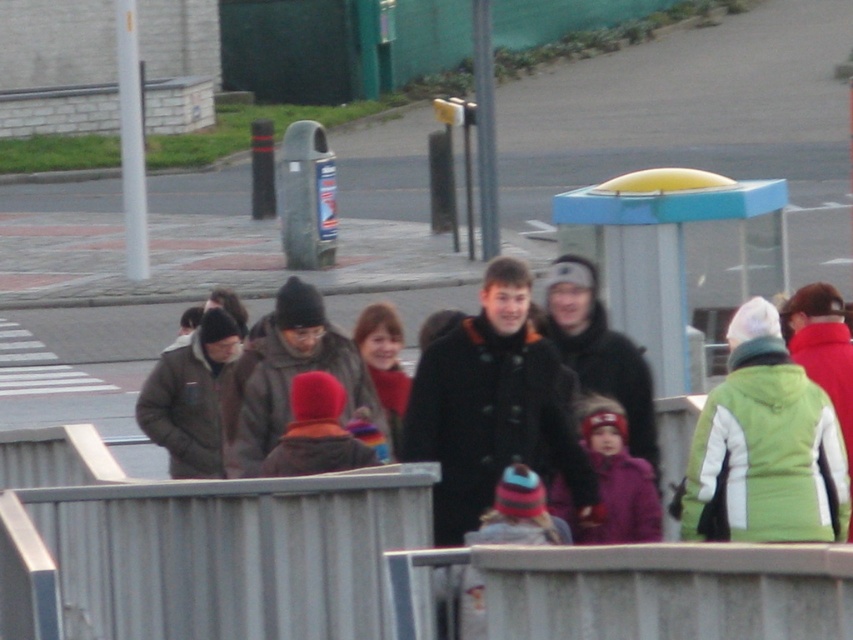
Question: Can you confirm if gray metallic rail at center is positioned below blue plastic bus stop at center?

Choices:
 (A) no
 (B) yes

Answer: (B)

Question: Is black wool coat at center above purple fleece jacket at center?

Choices:
 (A) no
 (B) yes

Answer: (B)

Question: Is metallic gray rail at lower center positioned behind purple fleece jacket at center?

Choices:
 (A) no
 (B) yes

Answer: (A)

Question: Among these points, which one is nearest to the camera?

Choices:
 (A) (589, 634)
 (B) (68, 529)

Answer: (A)

Question: Which of the following is the farthest from the observer?

Choices:
 (A) green and white jacket at right
 (B) blue plastic bus stop at center
 (C) metallic gray rail at lower center

Answer: (B)

Question: Among these objects, which one is nearest to the camera?

Choices:
 (A) black wool coat at center
 (B) metallic gray rail at lower center
 (C) gray metallic rail at center

Answer: (C)